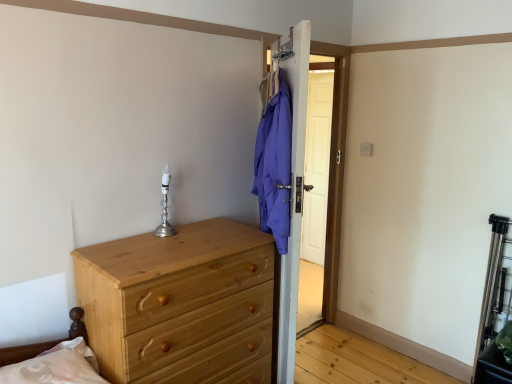
Question: Is point (73, 339) closer or farther from the camera than point (163, 188)?

Choices:
 (A) closer
 (B) farther

Answer: (A)

Question: From the image's perspective, is brown wooden bed frame at lower left above or below silver metallic candle holder at center?

Choices:
 (A) below
 (B) above

Answer: (A)

Question: Estimate the real-world distances between objects in this image. Which object is closer to the silver metallic candle holder at center?

Choices:
 (A) natural wood chest of drawers at lower left
 (B) brown wooden bed frame at lower left

Answer: (A)

Question: Estimate the real-world distances between objects in this image. Which object is closer to the brown wooden bed frame at lower left?

Choices:
 (A) silver metallic candle holder at center
 (B) natural wood chest of drawers at lower left

Answer: (B)